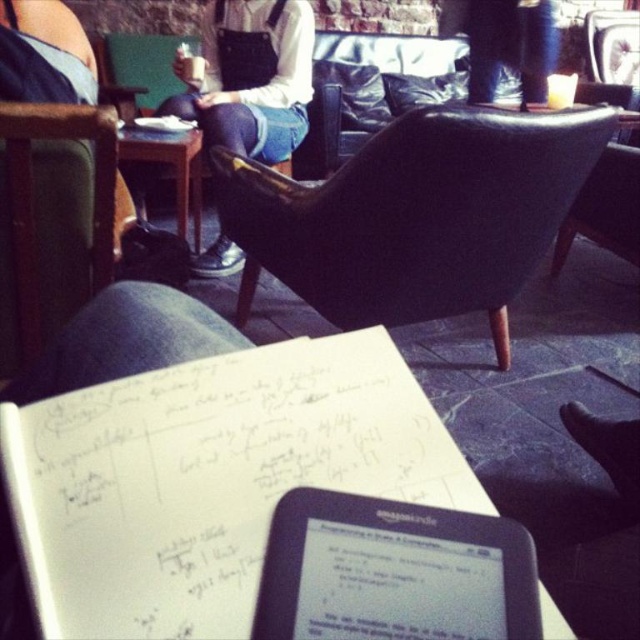
Question: Which point is farther to the camera?

Choices:
 (A) black matte tablet at lower center
 (B) green fabric armchair at left

Answer: (B)

Question: Does green fabric armchair at left come in front of wooden table at lower left?

Choices:
 (A) yes
 (B) no

Answer: (A)

Question: Can you confirm if black matte tablet at lower center is bigger than white paper notepad at center?

Choices:
 (A) no
 (B) yes

Answer: (A)

Question: Which of these objects is positioned farthest from the white paper at center?

Choices:
 (A) black leather armchair at center
 (B) white paper notepad at center
 (C) black matte tablet at lower center

Answer: (B)

Question: Observing the image, what is the correct spatial positioning of green fabric armchair at left in reference to white paper notepad at center?

Choices:
 (A) above
 (B) below

Answer: (B)

Question: Which of these objects is positioned closest to the green fabric armchair at left?

Choices:
 (A) wooden table at lower left
 (B) black leather armchair at center
 (C) white paper notepad at center

Answer: (B)